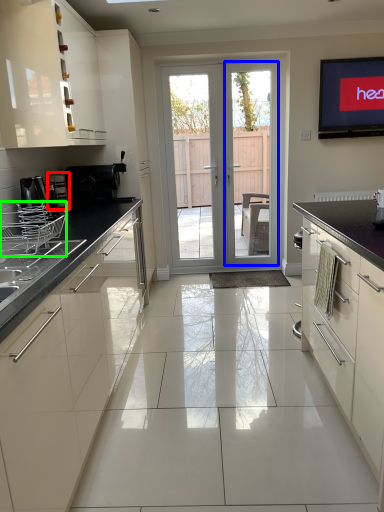
Question: Considering the real-world distances, which object is closest to appliance (highlighted by a red box)? screen door (highlighted by a blue box) or appliance (highlighted by a green box).

Choices:
 (A) screen door
 (B) appliance

Answer: (B)